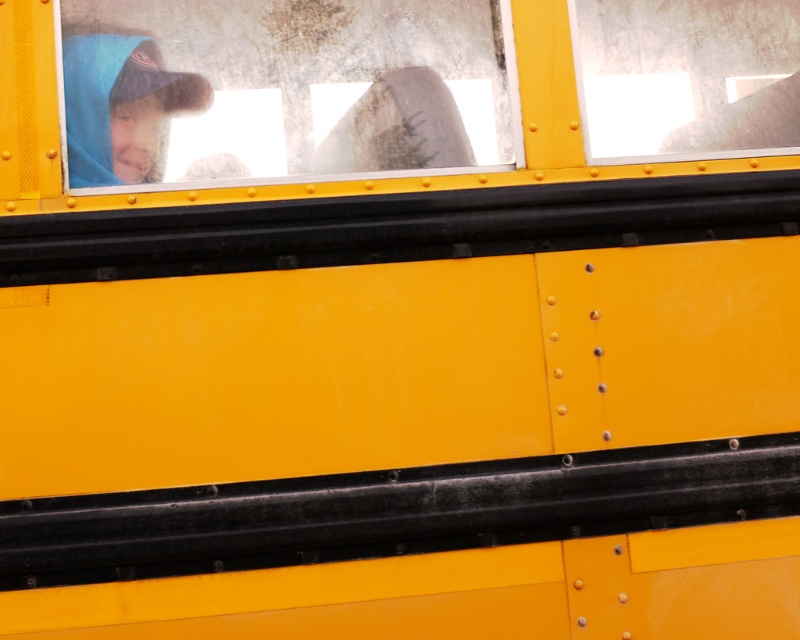
You are a passenger on the yellow school bus and want to see the blue fleece at upper left and the transparent glass window at upper left. Which object is located to the left of the other?

The transparent glass window at upper left is positioned on the right side of blue fleece at upper left, so the blue fleece at upper left is to the left of the transparent glass window at upper left.

You are a passenger on the yellow school bus and want to see the road ahead. Which object, the transparent glass window at upper right or the blue fleece at upper left, should you look through to get a clear view outside?

The transparent glass window at upper right is located above the blue fleece at upper left. Since the window is transparent and positioned higher, you should look through the transparent glass window at upper right to get a clear view outside.